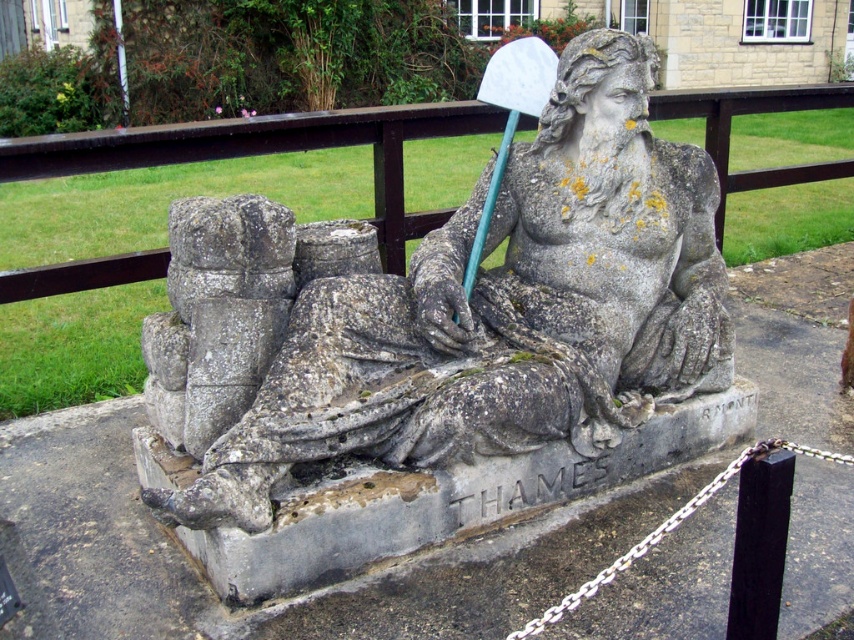
Which is above, stone statue at center or green plastic shovel at upper center?

green plastic shovel at upper center

Based on the photo, does stone statue at center have a smaller size compared to green plastic shovel at upper center?

Incorrect, stone statue at center is not smaller in size than green plastic shovel at upper center.

What do you see at coordinates (502, 310) in the screenshot? The image size is (854, 640). I see `stone statue at center` at bounding box center [502, 310].

Locate an element on the screen. This screenshot has width=854, height=640. stone statue at center is located at coordinates (502, 310).